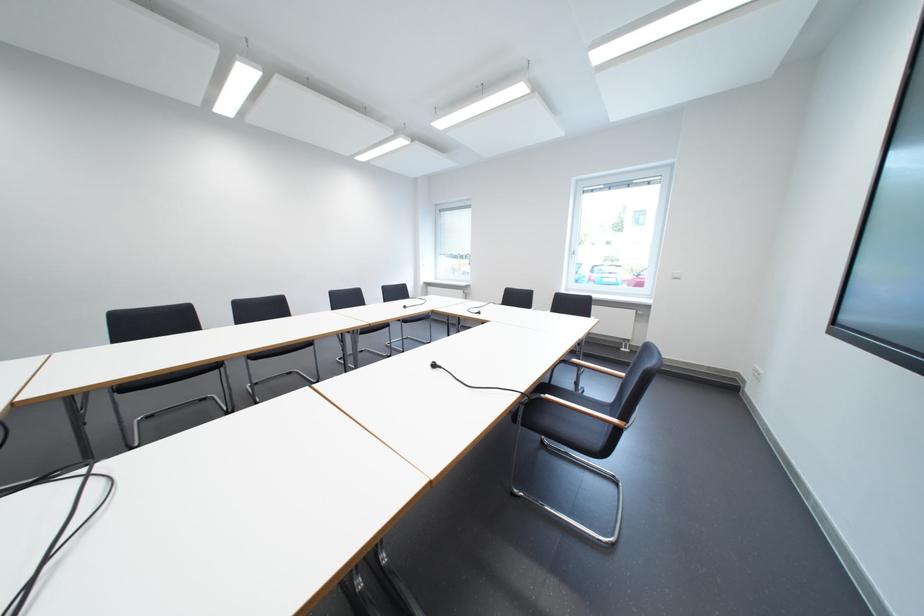
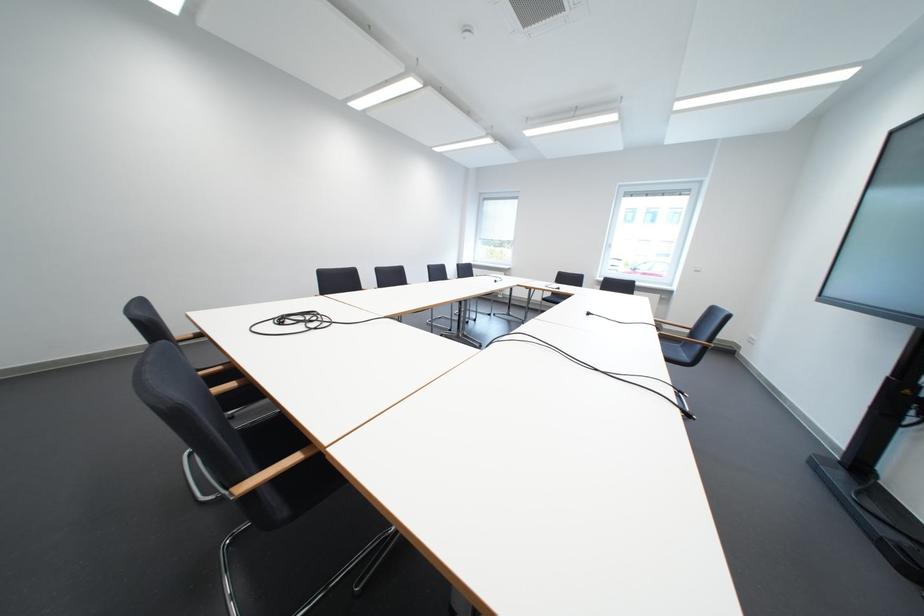
The point at (748, 376) is marked in the first image. Where is the corresponding point in the second image?

(746, 345)